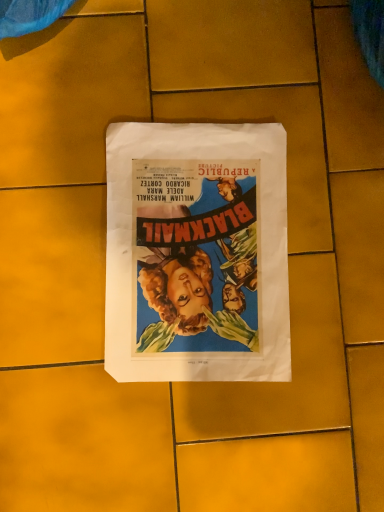
The image size is (384, 512). Describe the element at coordinates (197, 253) in the screenshot. I see `colorful paper poster at center` at that location.

Where is `colorful paper poster at center`? This screenshot has width=384, height=512. colorful paper poster at center is located at coordinates (197, 253).

Find the location of a particular element. The image size is (384, 512). colorful paper poster at center is located at coordinates (197, 253).